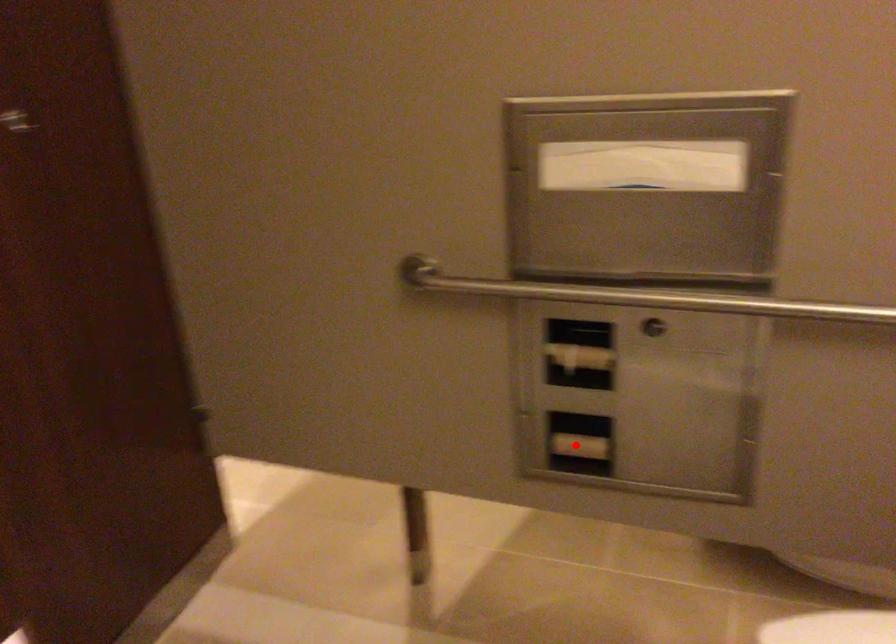
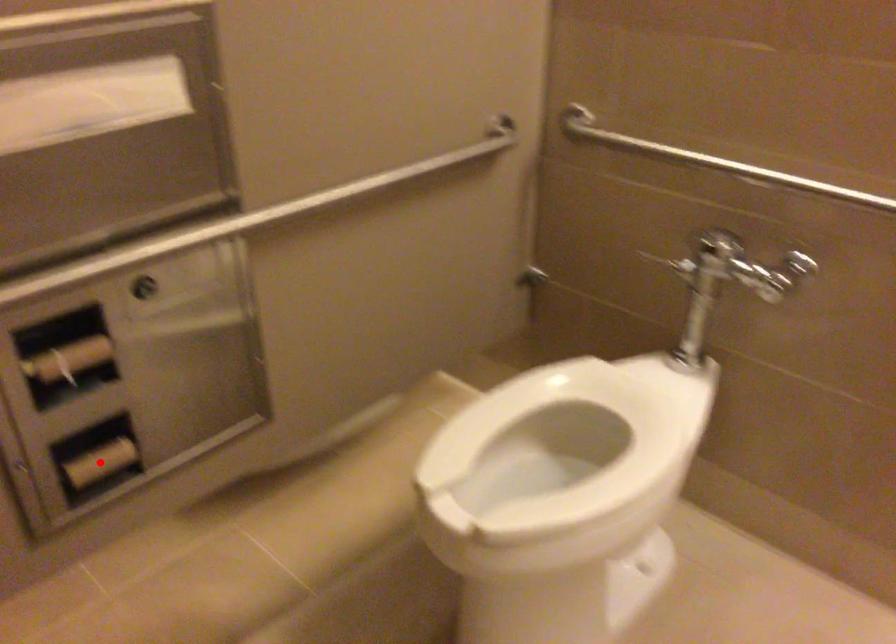
I am providing you with two images of the same scene from different viewpoints. A red point is marked on the first image and another point is marked on the second image. Do the highlighted points in image1 and image2 indicate the same real-world spot?

Yes